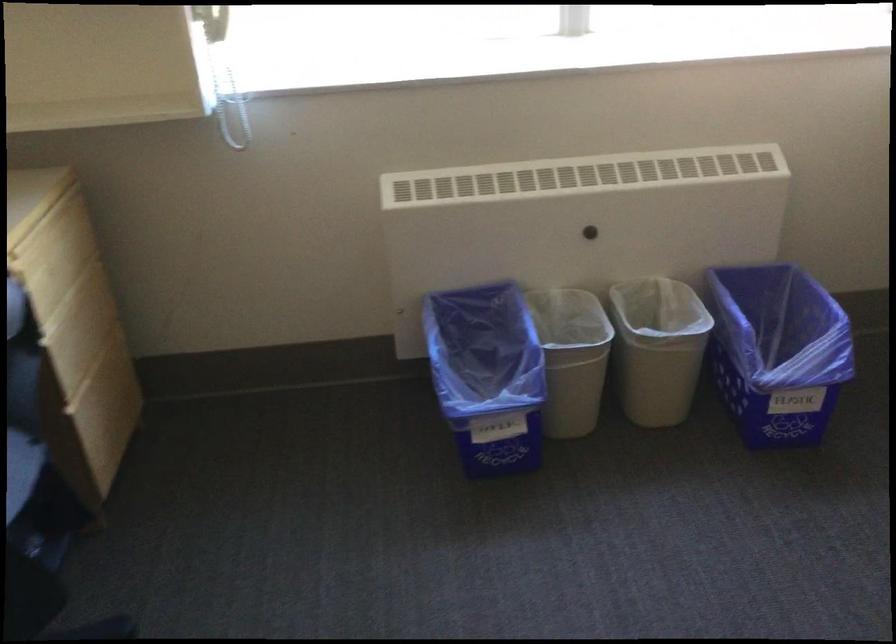
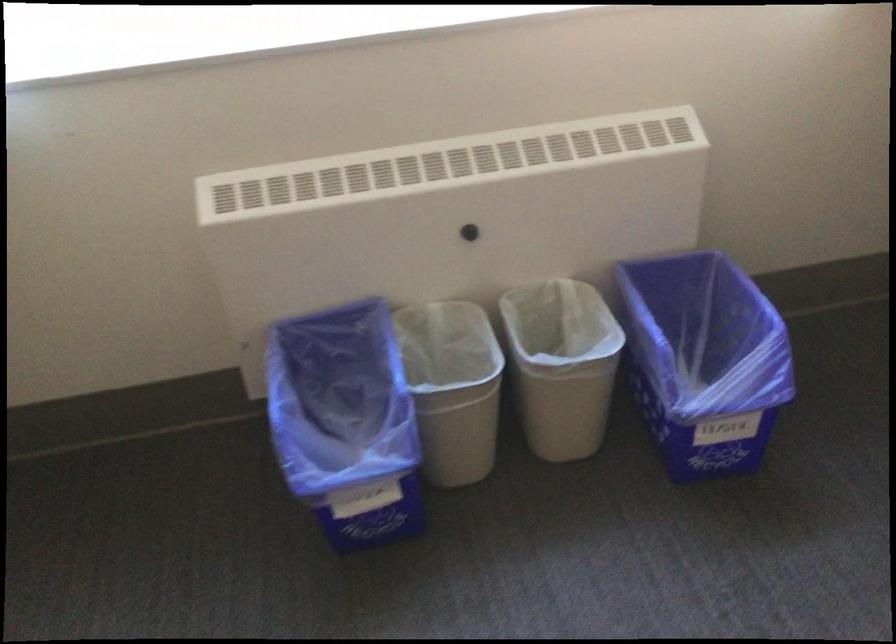
Locate, in the second image, the point that corresponds to [476,375] in the first image.

(345, 422)